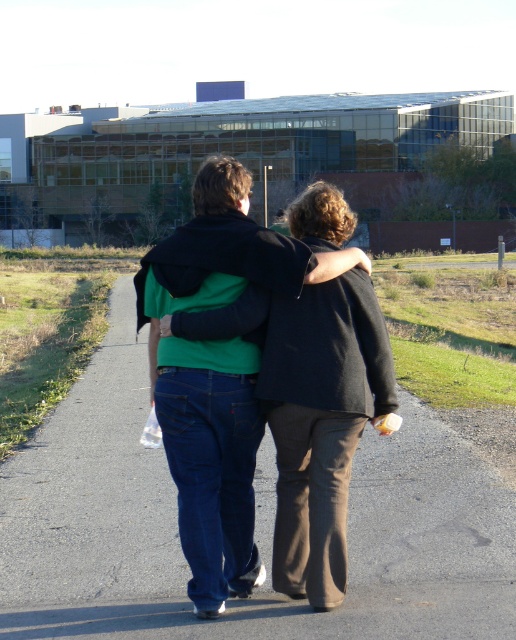
Consider the image. You are a delivery person trying to deliver a package to the green cotton hoodie at center. The smooth asphalt road at center is the only path available. Can you estimate if the road is wide enough to allow a delivery cart that is 1.2 meters wide to pass through?

The smooth asphalt road at center is wider than the green cotton hoodie at center. Since the road is wider than the delivery cart which is 1.2 meters wide, the cart can pass through the road.

You are a photographer trying to capture a photo of the smooth asphalt road at center and the green cotton hoodie at center. Since you want to ensure both are in focus, which object should you focus on first considering their sizes in the frame?

The smooth asphalt road at center is shorter than the green cotton hoodie at center, so you should focus on the green cotton hoodie at center first as it is larger in the frame.